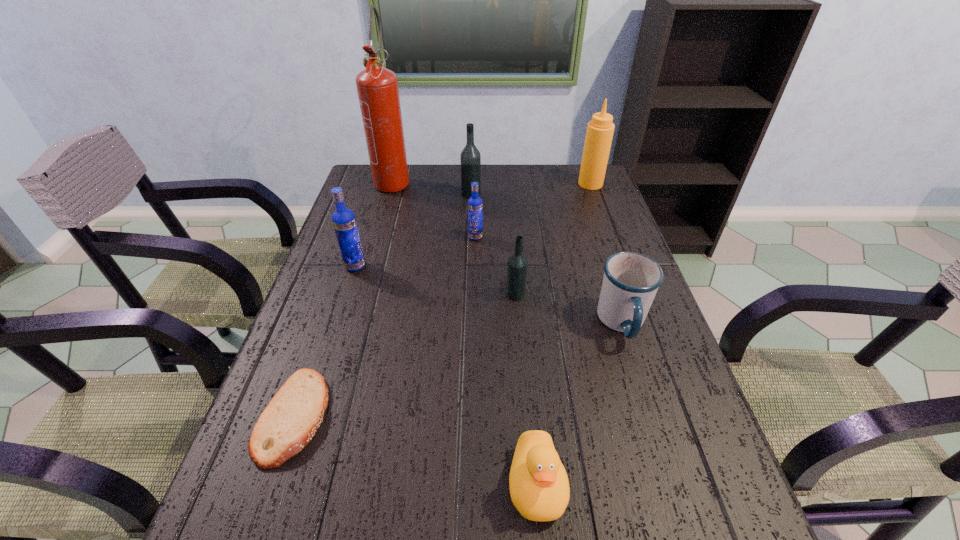
Where is `condiment that is positioned at the right edge`? The width and height of the screenshot is (960, 540). condiment that is positioned at the right edge is located at coordinates (599, 134).

Locate an element on the screen. mug at the right edge is located at coordinates (631, 280).

You are a GUI agent. You are given a task and a screenshot of the screen. Output one action in this format:
    pyautogui.click(x=<x>, y=<y>)
    Task: Click on the object located at the far left corner
    The height and width of the screenshot is (540, 960).
    Given the screenshot: What is the action you would take?
    pyautogui.click(x=377, y=87)

Find the location of a particular element. object that is at the far right corner is located at coordinates (599, 134).

You are a GUI agent. You are given a task and a screenshot of the screen. Output one action in this format:
    pyautogui.click(x=<x>, y=<y>)
    Task: Click on the free space at the far edge of the desktop
    
    Given the screenshot: What is the action you would take?
    pyautogui.click(x=532, y=176)

Find the location of `vacant space at the left edge`. vacant space at the left edge is located at coordinates (318, 330).

In the image, there is a desktop. What are the coordinates of `free space at the right edge` in the screenshot? It's located at (644, 330).

This screenshot has width=960, height=540. I want to click on free space between the pita bread and the nearest vodka, so click(x=405, y=355).

Find the location of a particular element. The width and height of the screenshot is (960, 540). free spot between the shortest object and the nearest vodka is located at coordinates (405, 355).

Find the location of a particular element. The width and height of the screenshot is (960, 540). free area in between the farther black vodka and the smaller black vodka is located at coordinates [x=493, y=244].